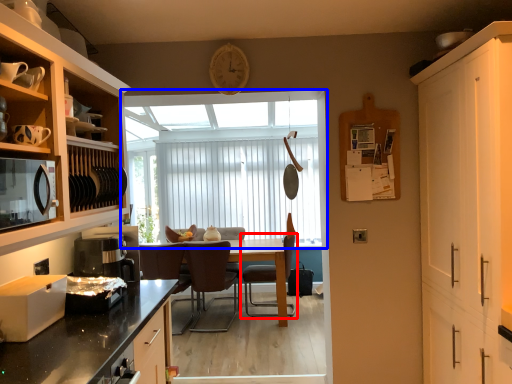
Question: Which object appears closest to the camera in this image, chair (highlighted by a red box) or window (highlighted by a blue box)?

Choices:
 (A) chair
 (B) window

Answer: (A)